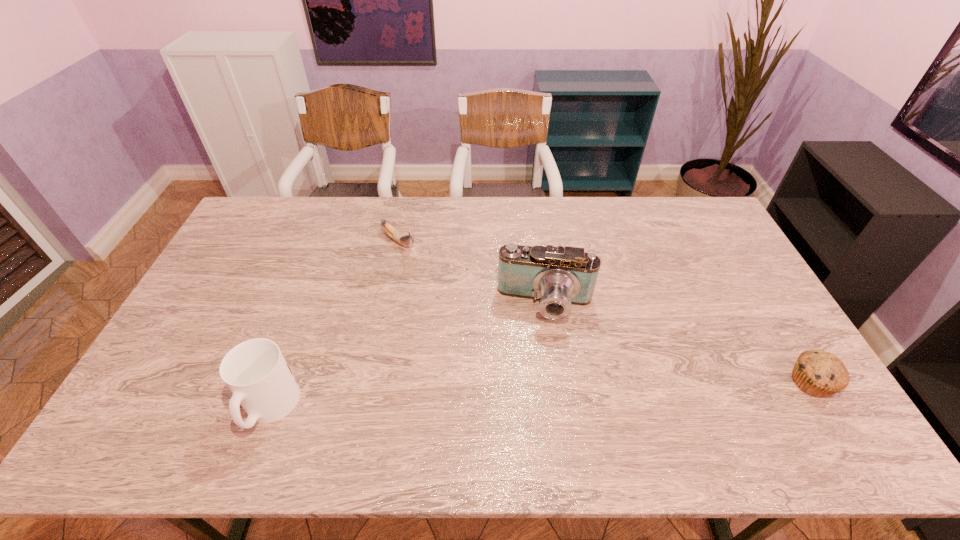
Where is `free space between the leftmost object and the second object from left to right`? free space between the leftmost object and the second object from left to right is located at coordinates (334, 325).

I want to click on empty location between the banana and the muffin, so click(605, 312).

This screenshot has height=540, width=960. I want to click on object that is the third closest one to the rightmost object, so click(x=255, y=371).

Locate which object ranks in proximity to the mug. Please provide its 2D coordinates. Your answer should be formatted as a tuple, i.e. [(x, y)], where the tuple contains the x and y coordinates of a point satisfying the conditions above.

[(405, 240)]

The image size is (960, 540). What are the coordinates of `free region that satisfies the following two spatial constraints: 1. on the front side of the camcorder; 2. on the right side of the muffin` in the screenshot? It's located at click(x=557, y=382).

At what (x,y) coordinates should I click in order to perform the action: click on free region that satisfies the following two spatial constraints: 1. on the front side of the second farthest object; 2. on the right side of the rightmost object. Please return your answer as a coordinate pair (x, y). This screenshot has width=960, height=540. Looking at the image, I should click on pyautogui.click(x=557, y=382).